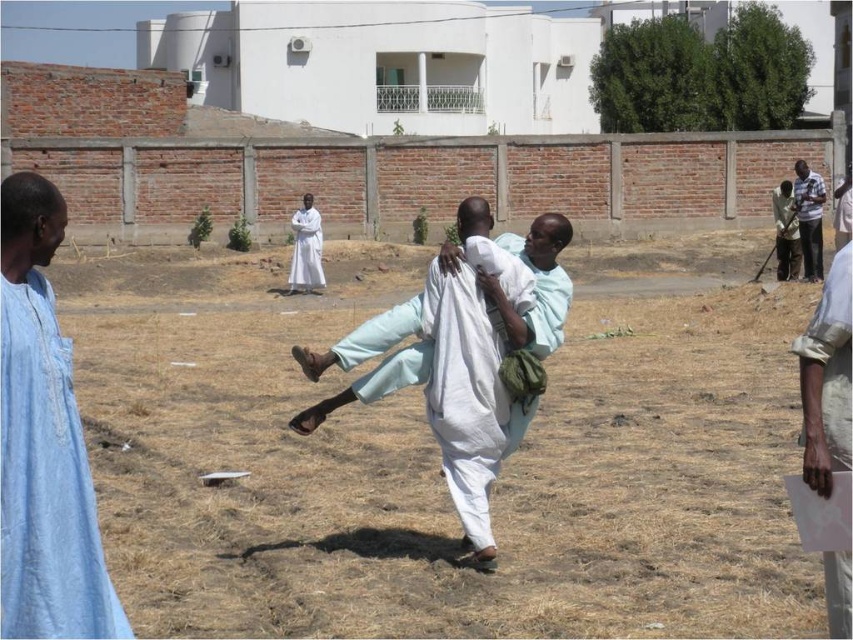
Who is more forward, (846, 401) or (820, 253)?

Positioned in front is point (846, 401).

Where is `light beige fabric hand at right`? The image size is (853, 640). light beige fabric hand at right is located at coordinates (827, 380).

Is light beige fabric hand at right below white matte robe at center?

Yes.

This screenshot has height=640, width=853. In order to click on light beige fabric hand at right in this screenshot , I will do `click(827, 380)`.

You are a GUI agent. You are given a task and a screenshot of the screen. Output one action in this format:
    pyautogui.click(x=<x>, y=<y>)
    Task: Click on the light beige fabric hand at right
    The image size is (853, 640).
    Given the screenshot: What is the action you would take?
    pyautogui.click(x=827, y=380)

Who is more forward, (x=544, y=291) or (x=796, y=202)?

Point (x=544, y=291)

Does white cotton cloth at center have a lesser height compared to striped cotton shirt at right?

Correct, white cotton cloth at center is not as tall as striped cotton shirt at right.

Is point (560, 298) positioned after point (821, 243)?

No, it is not.

Identify the location of white cotton cloth at center. The height and width of the screenshot is (640, 853). (543, 285).